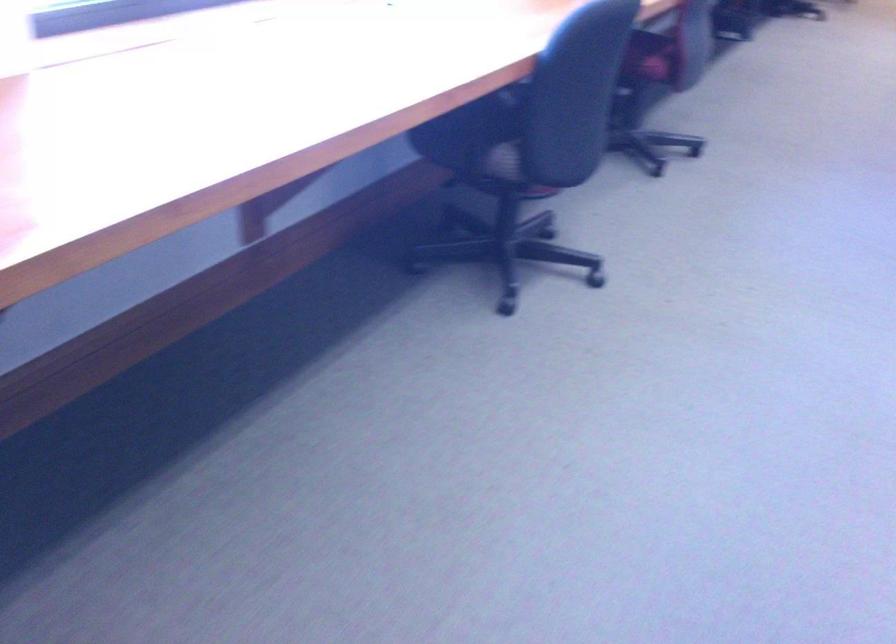
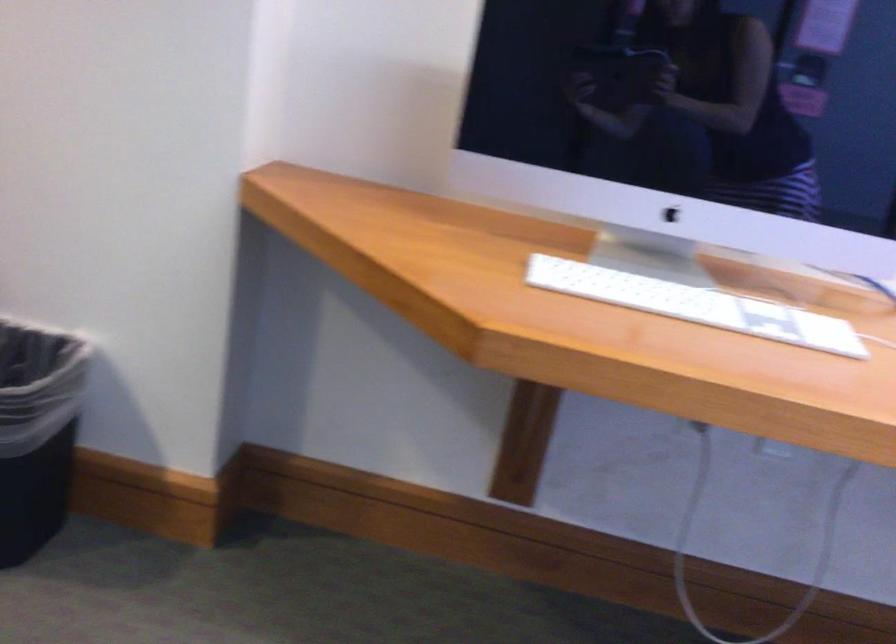
Question: Based on the continuous images, in which direction is the camera rotating? Reply with the corresponding letter.

Choices:
 (A) Left
 (B) Right
 (C) Up
 (D) Down

Answer: (A)